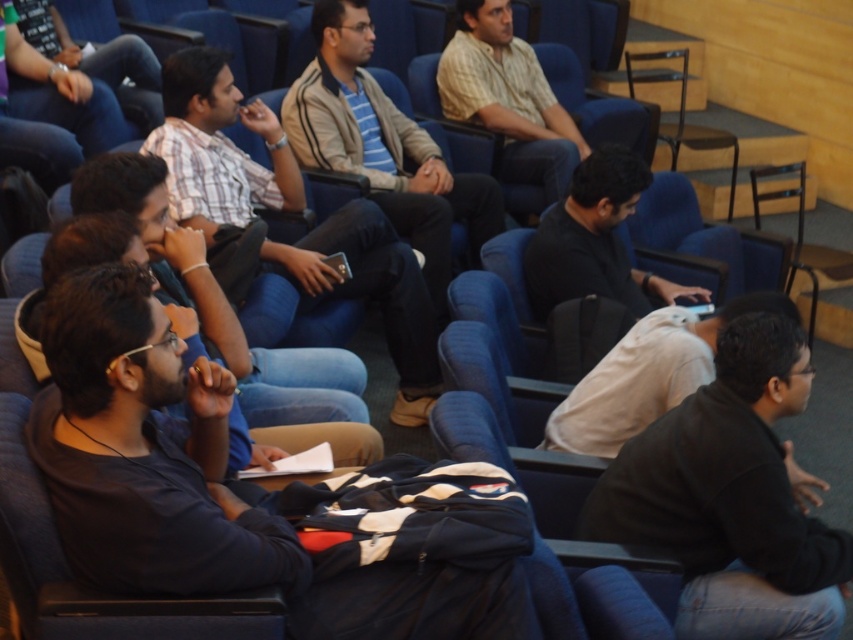
You are organizing a photo shoot and need to place two props next to the black matte jacket at lower right and the light brown textured shirt at center. Which prop should you place closer to the camera to ensure both props appear the same size in the photo?

The prop placed closer to the camera should be next to the black matte jacket at lower right because it has a lesser width than the light brown textured shirt at center. This way, the smaller jacket will appear larger when moved forward, balancing their sizes in the photo.

You are sitting in the auditorium and need to pass a note to the person wearing the light brown textured shirt at center and the dark blue jeans at upper left. Which direction should you move to reach both of them?

The light brown textured shirt at center is positioned on the right side of dark blue jeans at upper left. To reach both, you should move towards the center of the auditorium first to reach the light brown textured shirt at center, then move to the upper left to reach the dark blue jeans at upper left.

Please provide the 2D coordinates of the light brown textured shirt at center in the image. The coordinates should be in the format of a point with two decimal places, such as point 0.12, 0.34.

The light brown textured shirt at center is located at point (508, 97).